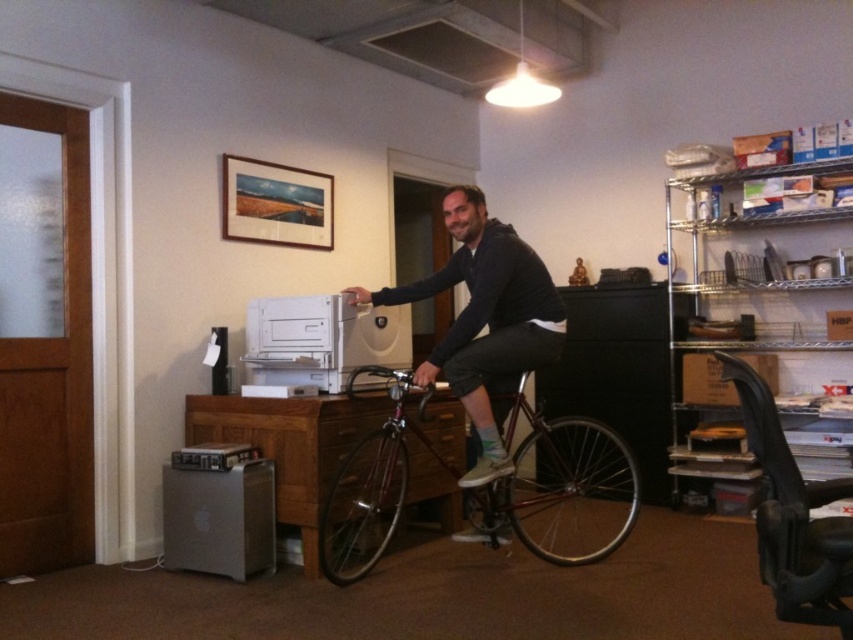
Question: Which of the following is the closest to the observer?

Choices:
 (A) click(x=163, y=512)
 (B) click(x=558, y=440)

Answer: (A)

Question: Can you confirm if shiny metallic bicycle at center is positioned to the right of sleek silver computer at lower left?

Choices:
 (A) no
 (B) yes

Answer: (B)

Question: Is shiny metallic bicycle at center closer to camera compared to sleek silver computer at lower left?

Choices:
 (A) yes
 (B) no

Answer: (A)

Question: Which of the following is the closest to the observer?

Choices:
 (A) (492, 224)
 (B) (235, 522)
 (C) (573, 552)

Answer: (B)

Question: Does shiny metallic bicycle at center have a larger size compared to matte black bicycle at center?

Choices:
 (A) no
 (B) yes

Answer: (B)

Question: Which of the following is the closest to the observer?

Choices:
 (A) (524, 378)
 (B) (274, 506)

Answer: (A)